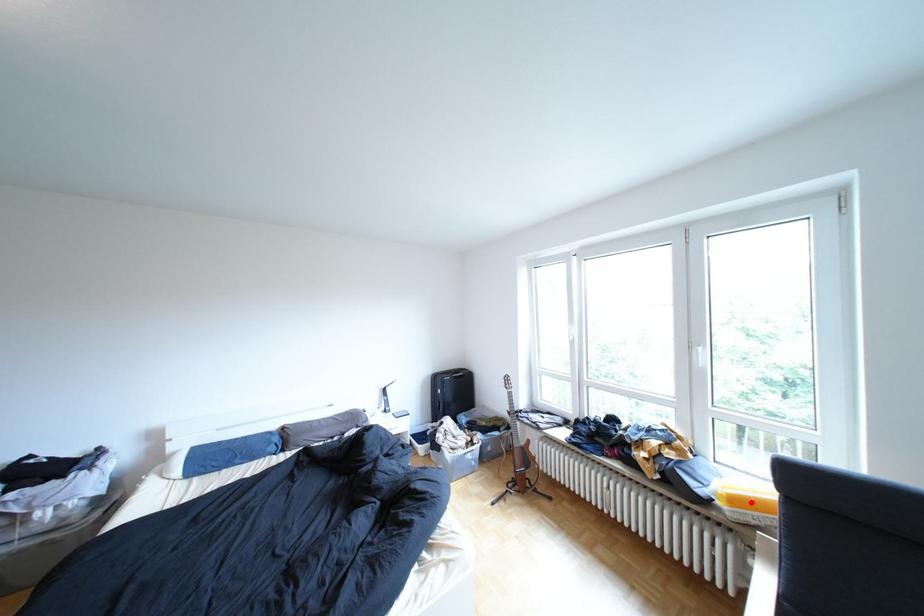
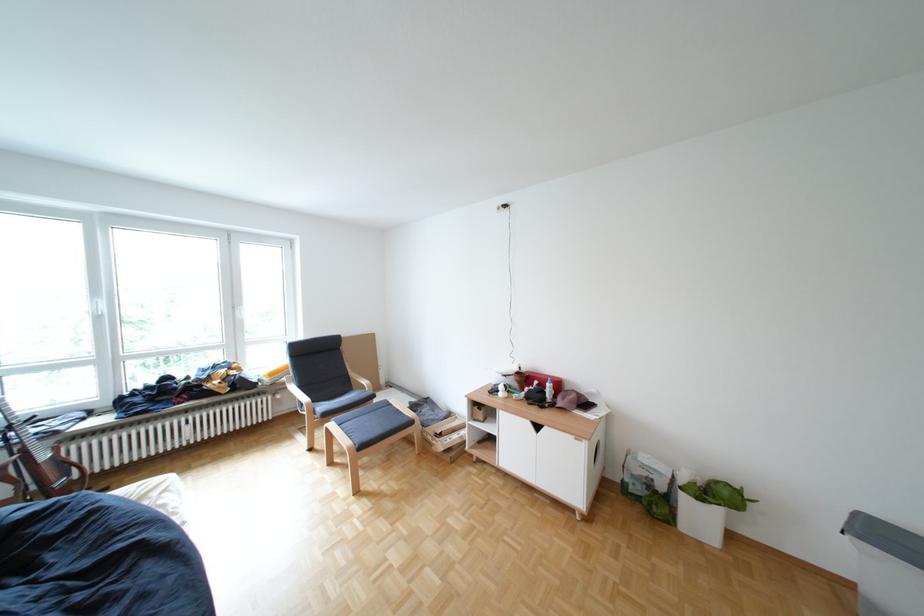
Locate, in the second image, the point that corresponds to the highlighted location in the first image.

(286, 374)